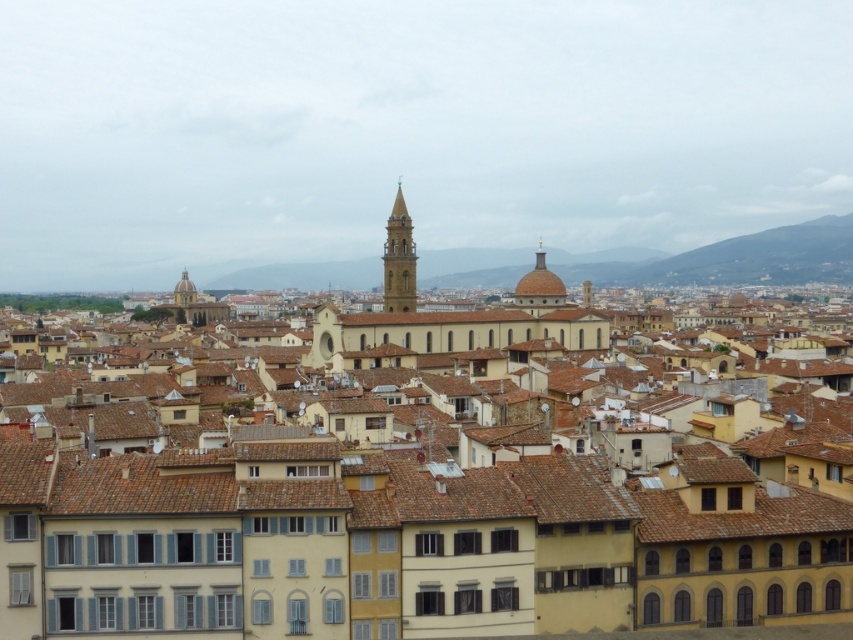
Can you confirm if yellow matte building at center is shorter than light brown stone tower at center?

Correct, yellow matte building at center is not as tall as light brown stone tower at center.

Who is higher up, yellow matte building at center or light brown stone tower at center?

light brown stone tower at center

Is point (486, 518) behind point (398, 230)?

No.

Find the location of a particular element. Image resolution: width=853 pixels, height=640 pixels. yellow matte building at center is located at coordinates (392, 544).

Is the position of golden dome at center less distant than that of matte gold dome at upper left?

Yes, golden dome at center is in front of matte gold dome at upper left.

Does golden dome at center have a lesser height compared to matte gold dome at upper left?

In fact, golden dome at center may be taller than matte gold dome at upper left.

Locate an element on the screen. golden dome at center is located at coordinates (538, 289).

This screenshot has width=853, height=640. Find the location of `golden dome at center`. golden dome at center is located at coordinates (538, 289).

Does point (405, 260) come behind point (181, 301)?

No, (405, 260) is in front of (181, 301).

Is the position of light brown stone tower at center more distant than that of matte gold dome at upper left?

That is False.

Which is in front, point (415, 282) or point (178, 305)?

Point (415, 282) is more forward.

You are a GUI agent. You are given a task and a screenshot of the screen. Output one action in this format:
    pyautogui.click(x=<x>, y=<y>)
    Task: Click on the light brown stone tower at center
    Image resolution: width=853 pixels, height=640 pixels.
    Given the screenshot: What is the action you would take?
    pyautogui.click(x=399, y=259)